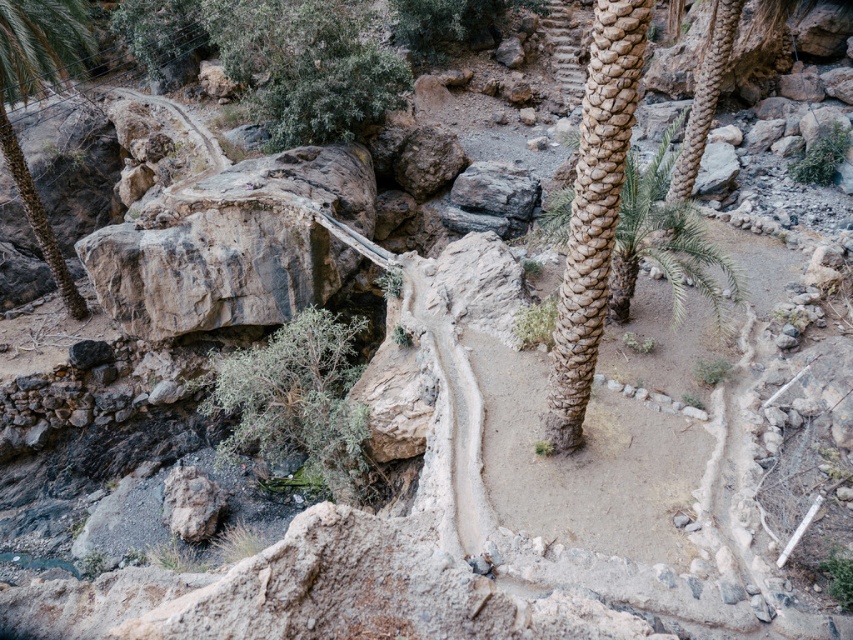
You are a hiker trying to navigate through this arid landscape. You notice two plants along the path. The green leafy bush at center and the green leafy palm at left. Which one is shorter?

The green leafy bush at center is shorter than the green leafy palm at left.

You are a hiker navigating the rugged terrain and want to find the green leafy bush at center. Based on the image, where would you look relative to the green leafy bush at upper right?

The green leafy bush at center is positioned under the green leafy bush at upper right, so you should look downward or below the green leafy bush at upper right to find it.